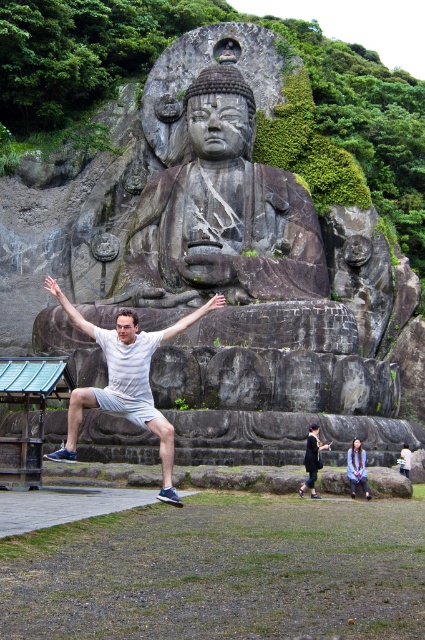
Question: Among these objects, which one is nearest to the camera?

Choices:
 (A) black fabric bag at lower center
 (B) denim jacket at lower right
 (C) white cotton shirt at center
 (D) gray stone statue at center

Answer: (C)

Question: Based on their relative distances, which object is farther from the black fabric bag at lower center?

Choices:
 (A) white fabric shirt at lower center
 (B) white matte arm at center

Answer: (B)

Question: Considering the relative positions of white matte arm at center and white fabric shirt at lower center in the image provided, where is white matte arm at center located with respect to white fabric shirt at lower center?

Choices:
 (A) below
 (B) above

Answer: (B)

Question: Does white matte arm at center come in front of white matte arm at upper center?

Choices:
 (A) yes
 (B) no

Answer: (A)

Question: Which is farther from the gray stone statue at center?

Choices:
 (A) white matte arm at upper center
 (B) denim jacket at lower right
 (C) white matte arm at center

Answer: (B)

Question: Considering the relative positions of gray stone statue at center and denim jacket at lower right in the image provided, where is gray stone statue at center located with respect to denim jacket at lower right?

Choices:
 (A) left
 (B) right

Answer: (A)